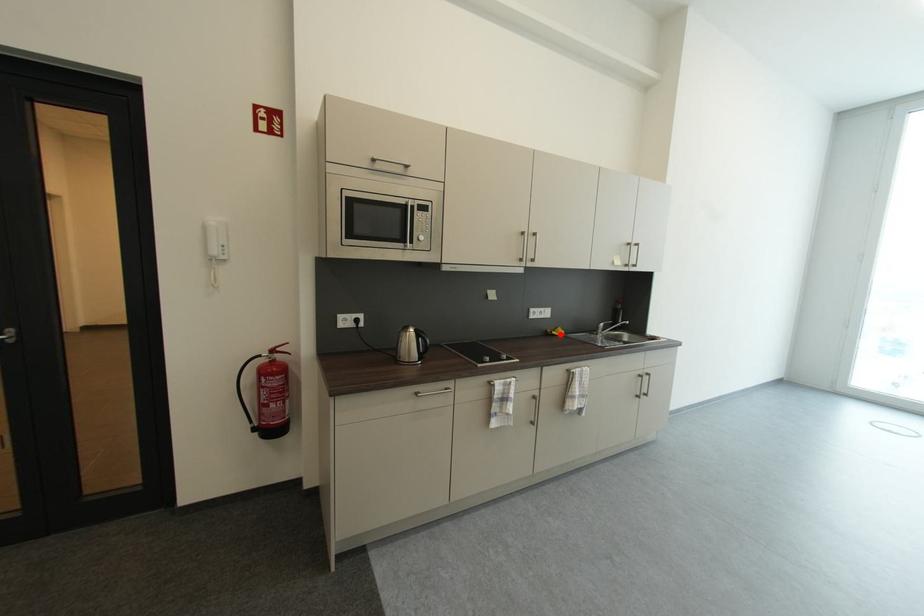
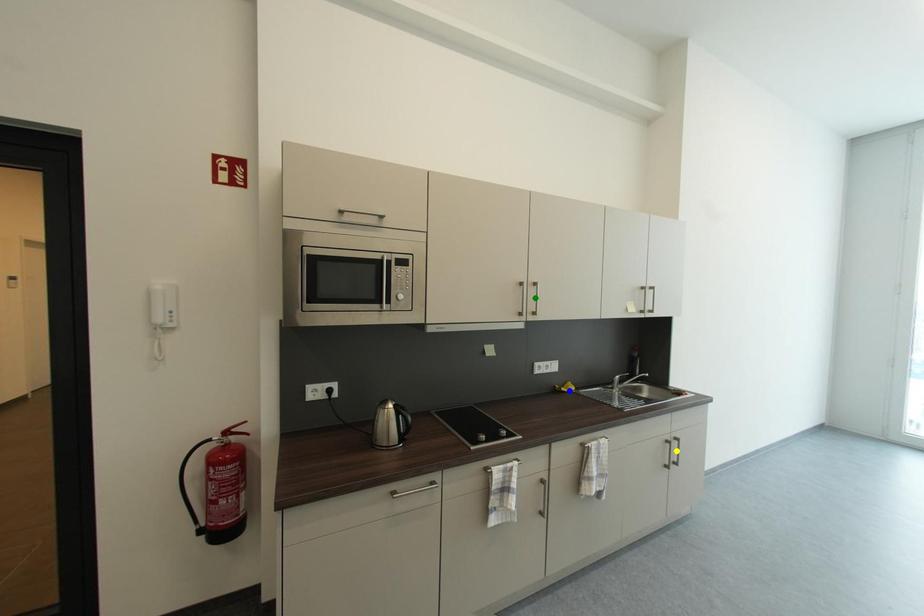
Question: I am providing you with two images of the same scene from different viewpoints. A red point is marked on the first image. You are given multiple points on the second image. Which point in image 2 represents the same 3d spot as the red point in image 1?

Choices:
 (A) blue point
 (B) green point
 (C) yellow point

Answer: (A)